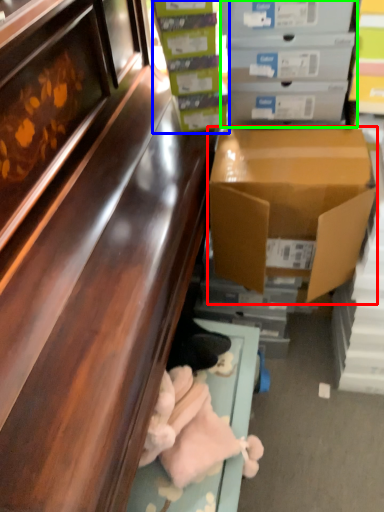
Question: Based on their relative distances, which object is farther from box (highlighted by a red box)? Choose from box (highlighted by a blue box) and box (highlighted by a green box).

Choices:
 (A) box
 (B) box

Answer: (A)